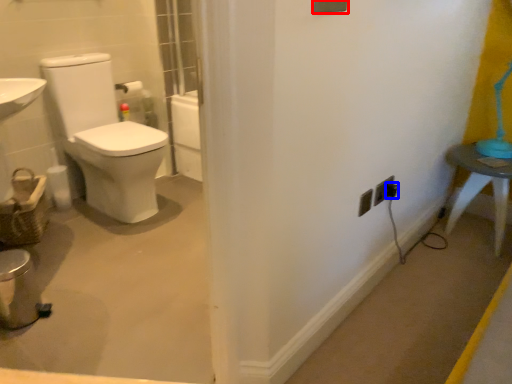
Question: Among these objects, which one is nearest to the camera, light switch (highlighted by a red box) or electric outlet (highlighted by a blue box)?

Choices:
 (A) light switch
 (B) electric outlet

Answer: (A)